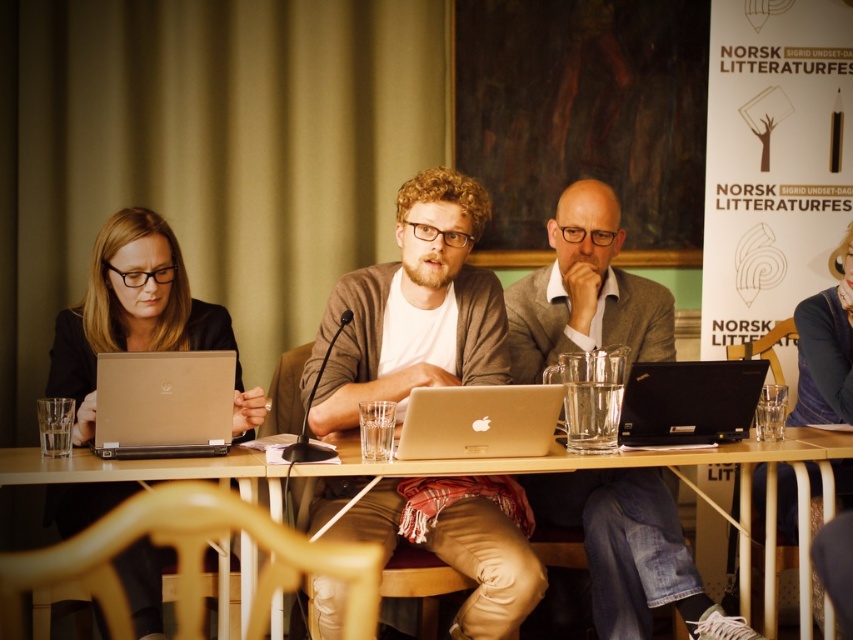
Which is in front, point (851, 266) or point (744, 408)?

Positioned in front is point (744, 408).

Is point (799, 394) behind point (703, 429)?

Yes, it is.

Is point (850, 486) in front of point (686, 390)?

No.

At what (x,y) coordinates should I click in order to perform the action: click on matte black jacket at center. Please return your answer as a coordinate pair (x, y). Looking at the image, I should click on (827, 348).

The image size is (853, 640). In order to click on matte brown cardigan at center in this screenshot , I will do `click(410, 310)`.

Which is more to the left, matte brown cardigan at center or black plastic laptop at center?

matte brown cardigan at center

Who is more forward, (459,188) or (645,432)?

Point (459,188) is in front.

Where is `matte brown cardigan at center`? matte brown cardigan at center is located at coordinates (410, 310).

Who is more forward, (102, 282) or (627, 404)?

Point (627, 404)

Where is `matte black laptop at left`? This screenshot has height=640, width=853. matte black laptop at left is located at coordinates (138, 317).